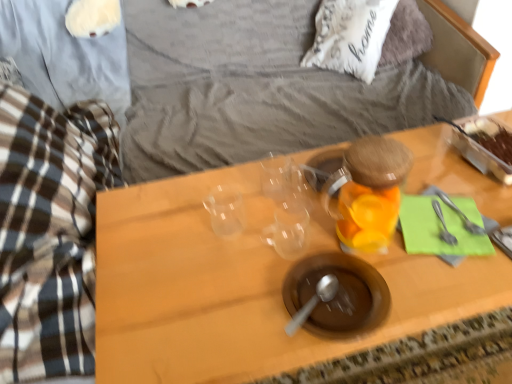
Locate an element on the screen. The width and height of the screenshot is (512, 384). vacant space in front of transparent glass jar at center-right is located at coordinates (404, 292).